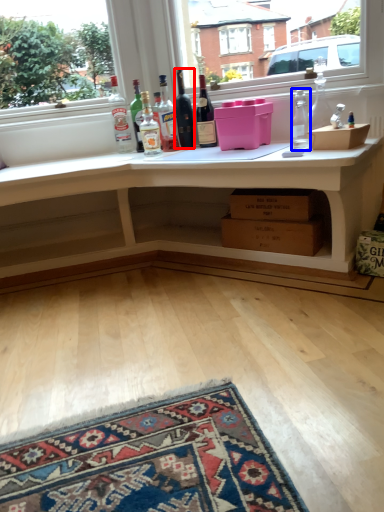
Question: Which point is further to the camera, bottle (highlighted by a red box) or bottle (highlighted by a blue box)?

Choices:
 (A) bottle
 (B) bottle

Answer: (A)